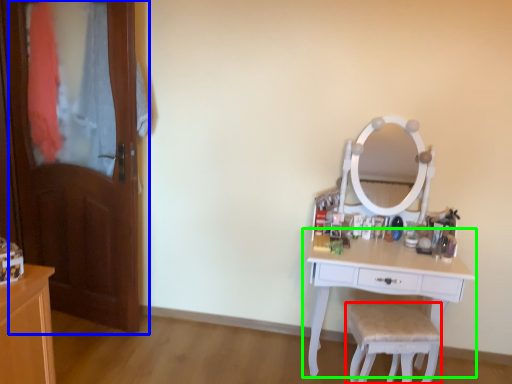
Question: Based on their relative distances, which object is farther from chair (highlighted by a red box)? Choose from door (highlighted by a blue box) and table (highlighted by a green box).

Choices:
 (A) door
 (B) table

Answer: (A)